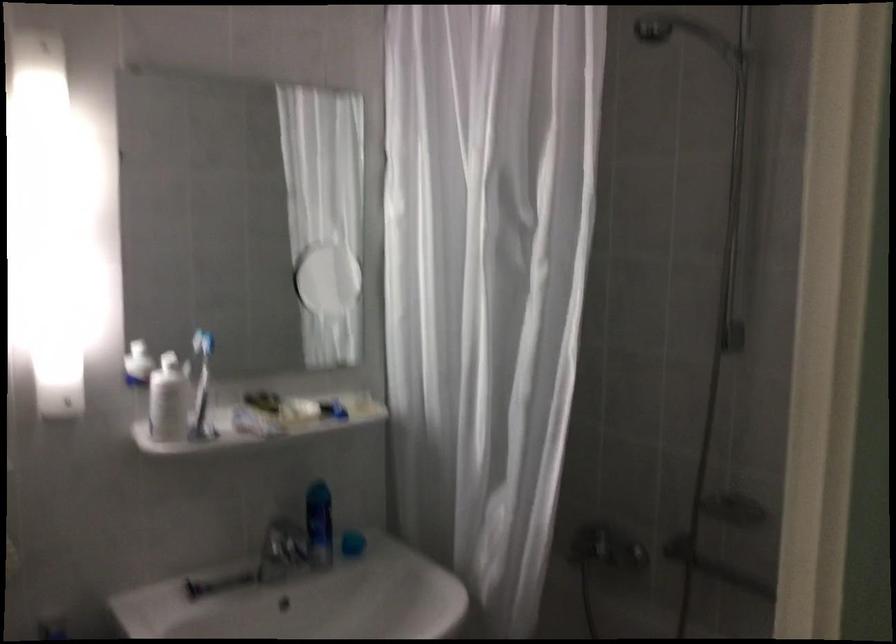
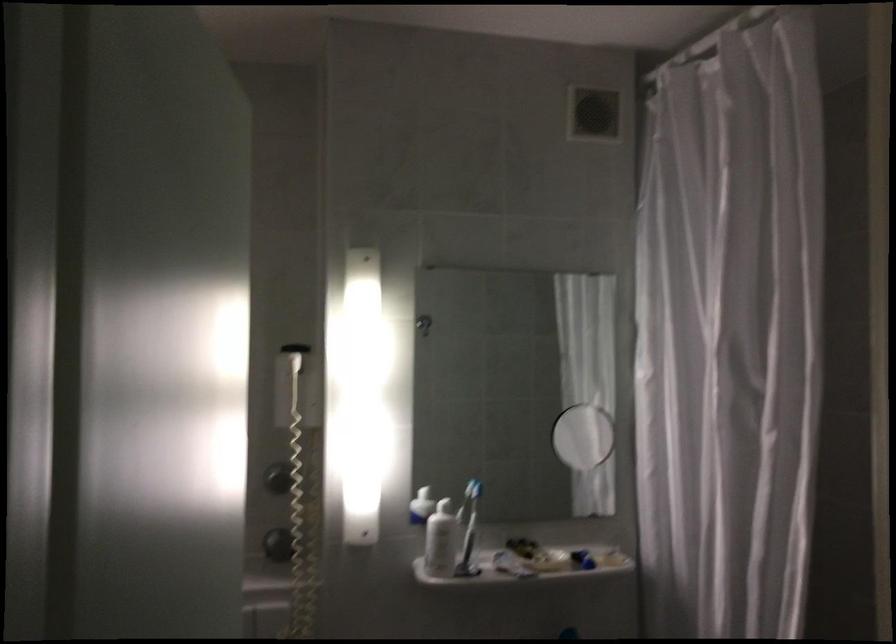
Where in the second image is the point corresponding to [200,386] from the first image?

(469, 529)